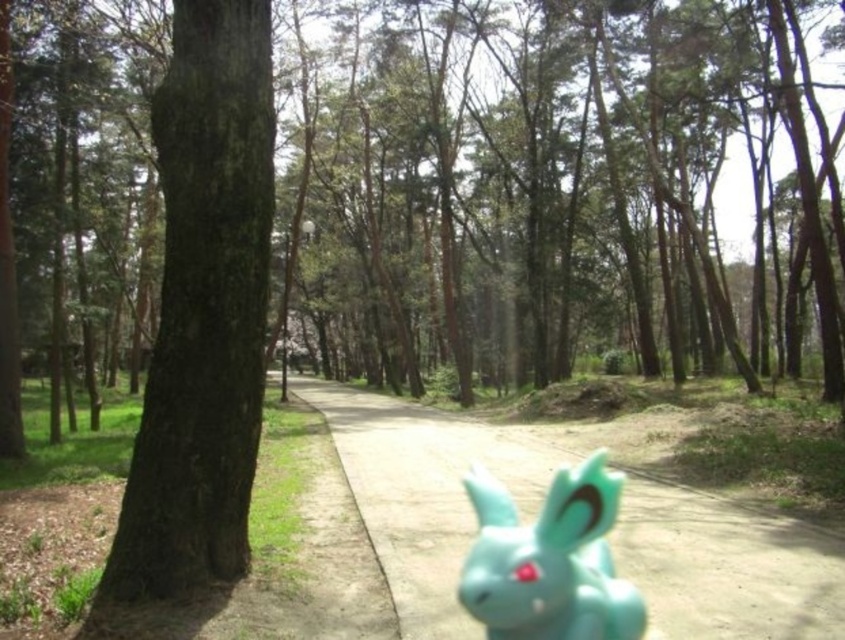
Looking at this image, is dark brown bark tree at left further to the viewer compared to teal matte bunny at center?

Yes, it is behind teal matte bunny at center.

The width and height of the screenshot is (845, 640). Find the location of `dark brown bark tree at left`. dark brown bark tree at left is located at coordinates (203, 308).

The image size is (845, 640). Find the location of `dark brown bark tree at left`. dark brown bark tree at left is located at coordinates (203, 308).

Does smooth concrete pavement at center have a lesser height compared to teal matte bunny at center?

Incorrect, smooth concrete pavement at center's height does not fall short of teal matte bunny at center's.

Between point (672, 544) and point (473, 612), which one is positioned behind?

Point (672, 544)

Does point (724, 564) lie behind point (505, 563)?

Yes.

Where is `smooth concrete pavement at center`? smooth concrete pavement at center is located at coordinates (424, 492).

Between point (216, 120) and point (369, 461), which one is positioned behind?

The point (369, 461) is more distant.

Is point (166, 516) more distant than point (415, 412)?

No, it is in front of (415, 412).

Locate an element on the screen. This screenshot has width=845, height=640. dark brown bark tree at left is located at coordinates (203, 308).